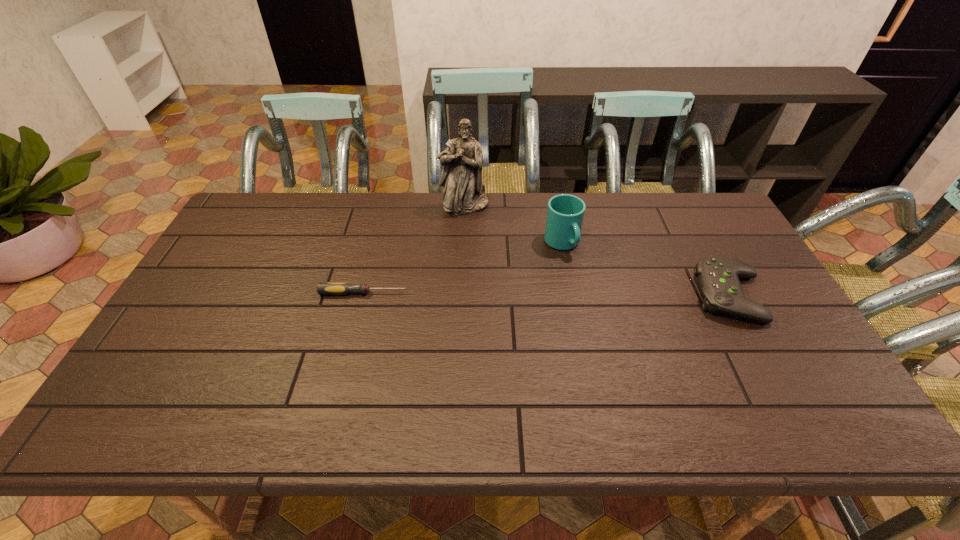
You are a GUI agent. You are given a task and a screenshot of the screen. Output one action in this format:
    pyautogui.click(x=<x>, y=<y>)
    Task: Click on the vacant space located on the handle side of the cup
    This screenshot has width=960, height=540.
    Given the screenshot: What is the action you would take?
    pyautogui.click(x=607, y=307)

Find the location of a particular element. This screenshot has width=960, height=540. free space located on the handle side of the cup is located at coordinates (646, 359).

Identify the location of free spot located on the handle side of the cup. Image resolution: width=960 pixels, height=540 pixels. (603, 301).

Identify the location of vacant space located 0.310m on the front-facing side of the farthest object. 504,279.

Where is `free space located 0.300m on the front-facing side of the farthest object`? The height and width of the screenshot is (540, 960). free space located 0.300m on the front-facing side of the farthest object is located at coordinates (502, 276).

This screenshot has width=960, height=540. In order to click on free space located 0.360m on the front-facing side of the farthest object in this screenshot , I will do `click(510, 291)`.

The image size is (960, 540). Find the location of `cup located at the far edge`. cup located at the far edge is located at coordinates (565, 213).

The width and height of the screenshot is (960, 540). Identify the location of figurine that is at the far edge. (461, 175).

I want to click on object at the right edge, so click(718, 277).

You are a GUI agent. You are given a task and a screenshot of the screen. Output one action in this format:
    pyautogui.click(x=<x>, y=<y>)
    Task: Click on the free space at the far edge of the desktop
    Image resolution: width=960 pixels, height=540 pixels.
    Given the screenshot: What is the action you would take?
    pyautogui.click(x=440, y=204)